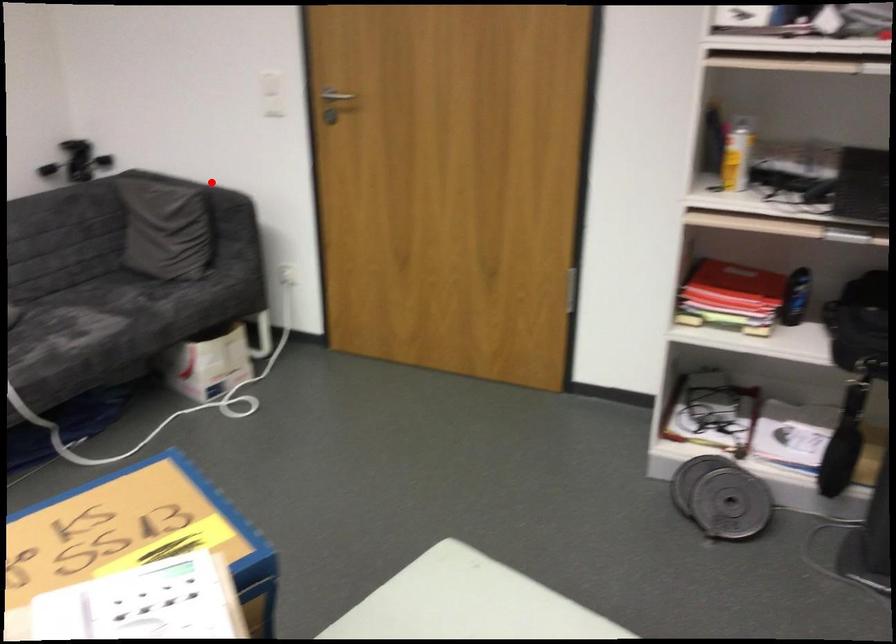
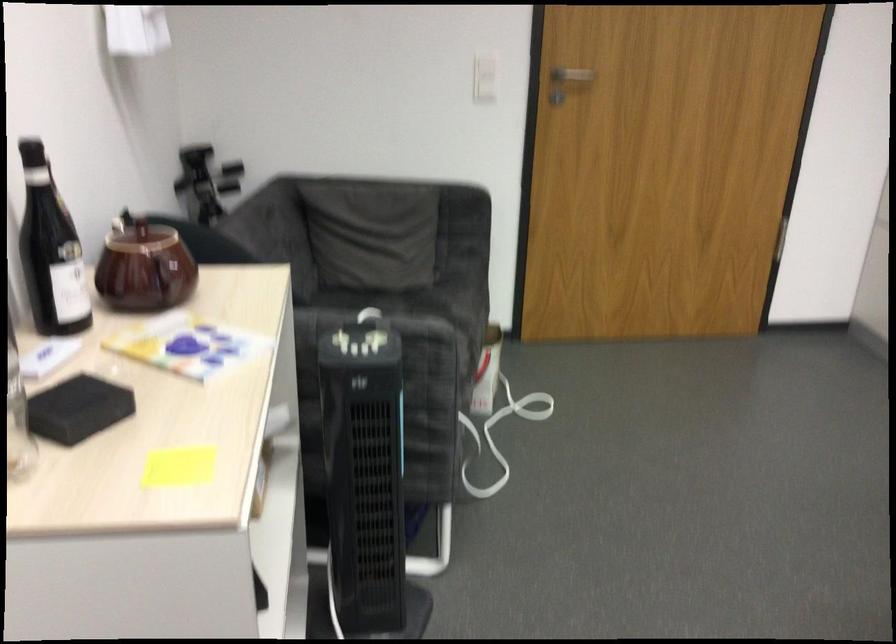
Where in the second image is the point corresponding to the highlighted location from the first image?

(388, 176)